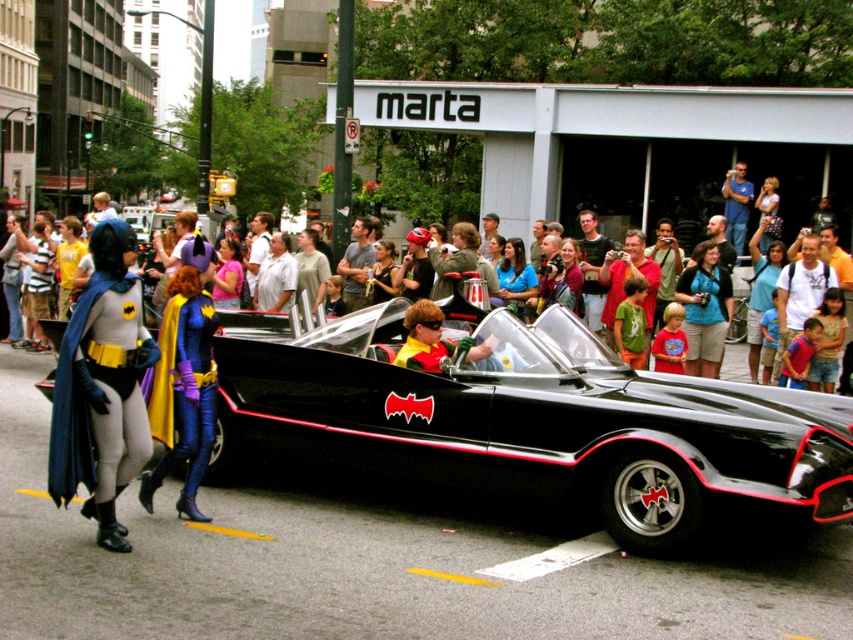
You are a photographer trying to capture the Batmobile and the superheroes in the scene. You notice a point at coordinates (102, 387) on your camera screen. What object is located at this point?

The point at coordinates (102, 387) marks the smooth gray bodysuit at left.

You are a photographer trying to capture a group photo of the smooth gray bodysuit at left and the shiny red and yellow costume at center. The camera you are using has a minimum focus distance of 2 meters. Will both subjects be in focus?

The smooth gray bodysuit at left and shiny red and yellow costume at center are 2.11 meters apart. Since the distance between them is greater than the camera minimum focus distance of 2 meters, both subjects will be in focus.

You are a photographer trying to capture a group photo of the smooth gray bodysuit at left and the shiny purple fabric cape at center. Since you want to ensure both are fully visible, which character should you position closer to the camera to avoid cropping?

The smooth gray bodysuit at left is wider than the shiny purple fabric cape at center, so positioning the smooth gray bodysuit at left closer to the camera will help ensure both are fully visible without cropping.